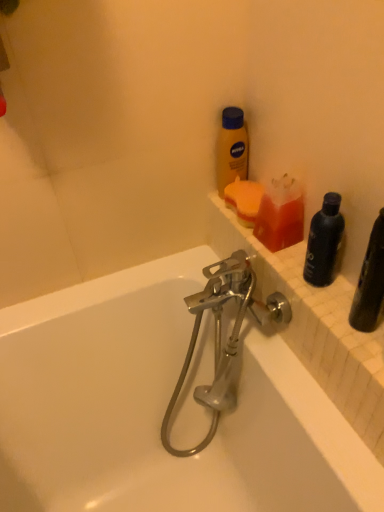
Question: Can you confirm if chrome metallic faucet at center is smaller than black matte bottle at right, which is the 2th bottle from left to right?

Choices:
 (A) no
 (B) yes

Answer: (A)

Question: Does chrome metallic faucet at center have a greater height compared to black matte bottle at right, which is the 1th bottle from right to left?

Choices:
 (A) yes
 (B) no

Answer: (A)

Question: Can you confirm if chrome metallic faucet at center is shorter than black matte bottle at right, marked as the first bottle in a bottom-to-top arrangement?

Choices:
 (A) no
 (B) yes

Answer: (A)

Question: From a real-world perspective, is chrome metallic faucet at center located higher than black matte bottle at right, which is the 1th bottle from right to left?

Choices:
 (A) no
 (B) yes

Answer: (A)

Question: From the image's perspective, does chrome metallic faucet at center appear lower than black matte bottle at right, marked as the 2th bottle in a back-to-front arrangement?

Choices:
 (A) yes
 (B) no

Answer: (A)

Question: In terms of height, does white tile ledge at upper right look taller or shorter compared to yellow matte lotion at upper center, which appears as the 2th bottle when viewed from the front?

Choices:
 (A) tall
 (B) short

Answer: (B)

Question: In the image, is white tile ledge at upper right positioned in front of or behind yellow matte lotion at upper center, which is counted as the 1th bottle, starting from the back?

Choices:
 (A) front
 (B) behind

Answer: (A)

Question: Is point (296, 266) closer or farther from the camera than point (248, 150)?

Choices:
 (A) closer
 (B) farther

Answer: (A)

Question: In terms of width, does white tile ledge at upper right look wider or thinner when compared to yellow matte lotion at upper center, the second bottle positioned from the bottom?

Choices:
 (A) thin
 (B) wide

Answer: (B)

Question: From the image's perspective, is white tile ledge at upper right above or below translucent orange soap at upper right, the 2th cleaning product viewed from the back?

Choices:
 (A) above
 (B) below

Answer: (B)

Question: In the image, is white tile ledge at upper right positioned in front of or behind translucent orange soap at upper right, the 2th cleaning product viewed from the back?

Choices:
 (A) behind
 (B) front

Answer: (B)

Question: Is white tile ledge at upper right inside or outside of translucent orange soap at upper right, placed as the 1th cleaning product when sorted from front to back?

Choices:
 (A) inside
 (B) outside

Answer: (B)

Question: Would you say white tile ledge at upper right is to the left or to the right of translucent orange soap at upper right, the 2th cleaning product viewed from the back, in the picture?

Choices:
 (A) right
 (B) left

Answer: (A)

Question: Considering the positions of orange sponge at upper right, which is the first cleaning product from back to front, and chrome metallic faucet at center in the image, is orange sponge at upper right, which is the first cleaning product from back to front, wider or thinner than chrome metallic faucet at center?

Choices:
 (A) wide
 (B) thin

Answer: (B)

Question: Does point (254, 215) appear closer or farther from the camera than point (240, 285)?

Choices:
 (A) closer
 (B) farther

Answer: (B)